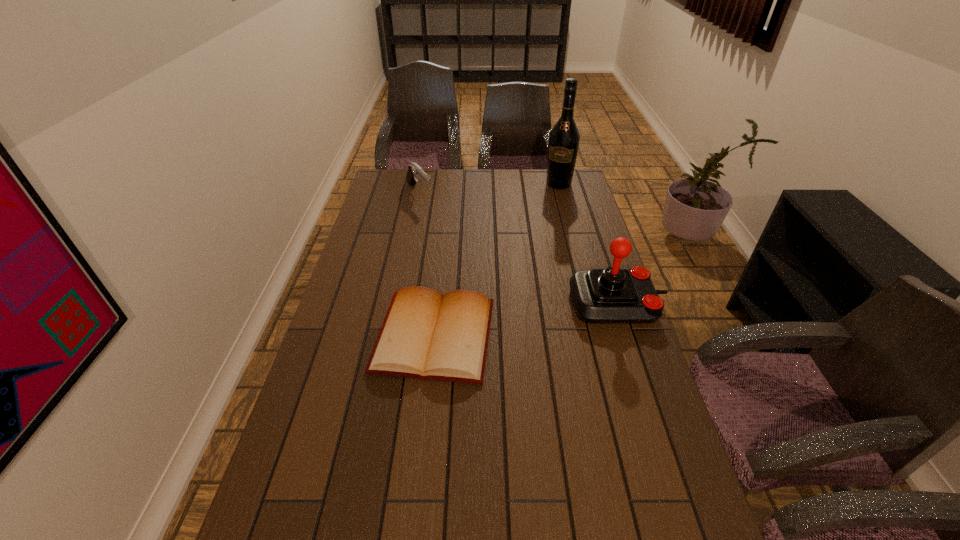
Locate an element on the screen. vacant space positioned 0.350m at the muzzle of the second shortest object is located at coordinates (471, 246).

Find the location of `wine bottle at the far edge`. wine bottle at the far edge is located at coordinates (564, 138).

Locate an element on the screen. This screenshot has width=960, height=540. gun that is positioned at the far edge is located at coordinates pos(415,171).

Identify the location of Bible that is at the left edge. (427, 335).

Identify the location of gun present at the left edge. This screenshot has height=540, width=960. (415, 171).

I want to click on joystick positioned at the right edge, so click(612, 295).

At what (x,y) coordinates should I click in order to perform the action: click on wine bottle that is at the right edge. Please return your answer as a coordinate pair (x, y). Looking at the image, I should click on (564, 138).

You are a GUI agent. You are given a task and a screenshot of the screen. Output one action in this format:
    pyautogui.click(x=<x>, y=<y>)
    Task: Click on the object that is at the far left corner
    
    Given the screenshot: What is the action you would take?
    pyautogui.click(x=415, y=171)

Where is `object that is at the far right corner`? This screenshot has width=960, height=540. object that is at the far right corner is located at coordinates (564, 138).

Find the location of a particular element. This screenshot has width=960, height=540. free space at the far edge is located at coordinates (521, 177).